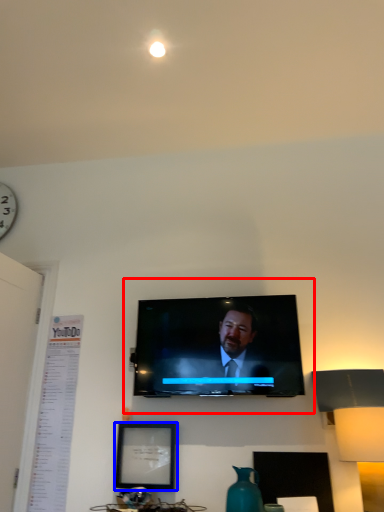
Question: Which point is closer to the camera, tv show (highlighted by a red box) or picture frame (highlighted by a blue box)?

Choices:
 (A) tv show
 (B) picture frame

Answer: (A)